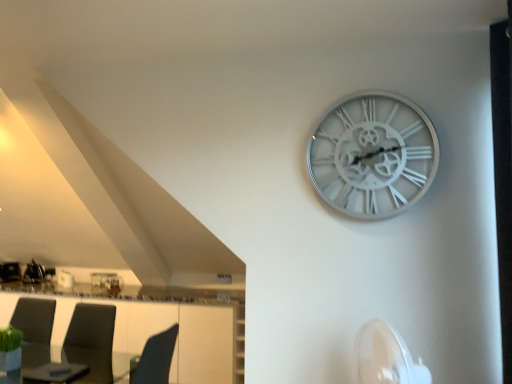
Question: Should I look upward or downward to see white metallic clock at upper right?

Choices:
 (A) down
 (B) up

Answer: (B)